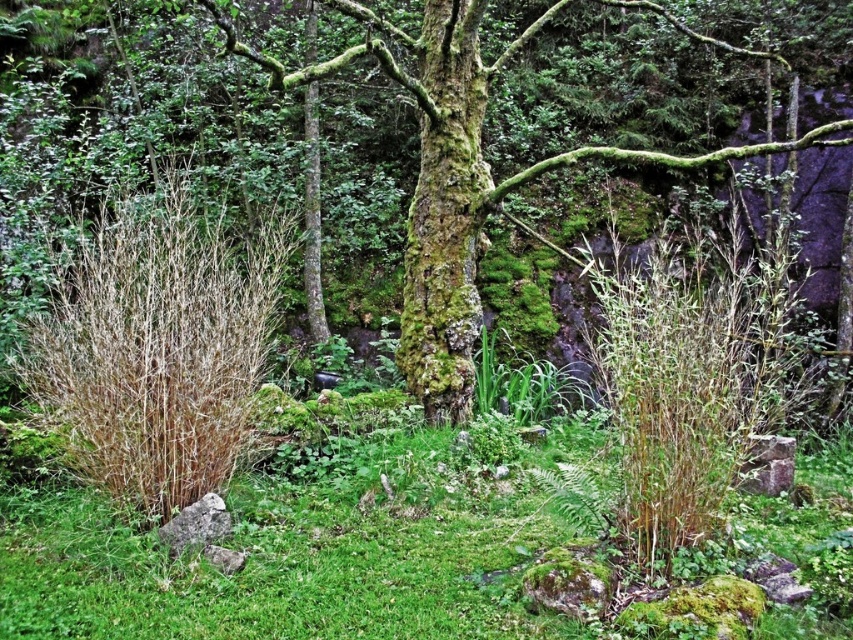
You are a hiker who wants to take a photo of the green mossy tree at center. You notice there is green mossy grass at center in front of it. Will the grass block your view of the tree?

The green mossy grass at center is shorter than the green mossy tree at center, so it will not block your view of the tree.

You are a hiker who has lost their way in the forest. You see the green mossy grass at center. Can you estimate its exact 2D coordinates based on the image?

The green mossy grass at center is located at coordinates point (287,557).

You are a hiker who wants to take a photo of the green mossy tree at center and the green mossy grass at center. Which object should you focus on first if you want to capture both in the same frame without moving your camera?

You should focus on the green mossy tree at center first because the green mossy grass at center is positioned on its left side, so adjusting focus to the tree will ensure both are in the frame as the grass is adjacent to it.